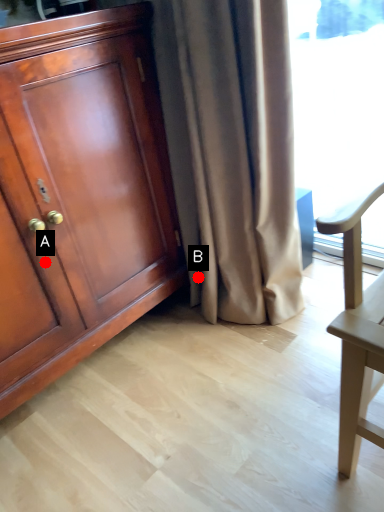
Question: Two points are circled on the image, labeled by A and B beside each circle. Which point is closer to the camera taking this photo?

Choices:
 (A) A is closer
 (B) B is closer

Answer: (A)